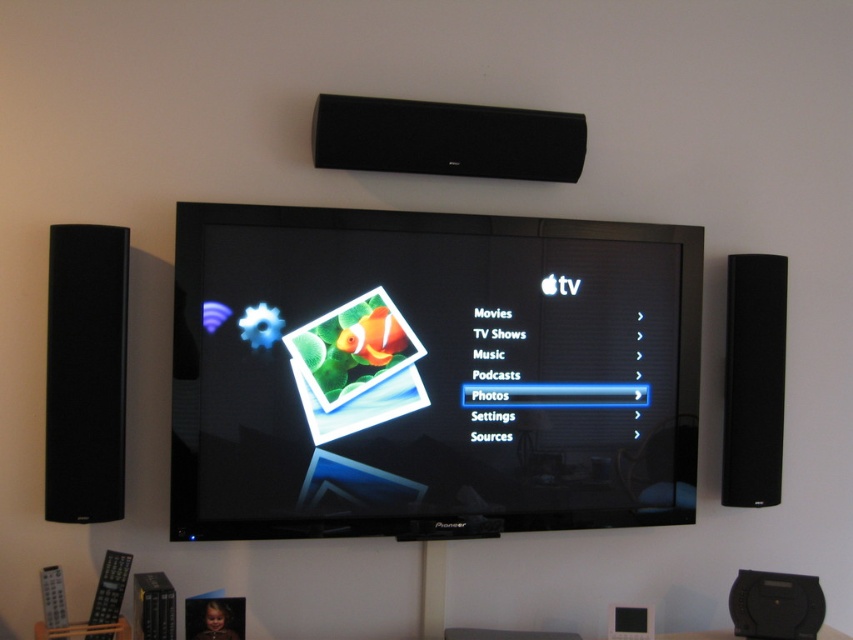
Can you confirm if black matte speaker at left is bigger than black matte speaker at upper center?

No, black matte speaker at left is not bigger than black matte speaker at upper center.

Does black matte speaker at left appear over black matte speaker at upper center?

Actually, black matte speaker at left is below black matte speaker at upper center.

Does point (74, 476) come closer to viewer compared to point (566, 115)?

That is True.

You are a GUI agent. You are given a task and a screenshot of the screen. Output one action in this format:
    pyautogui.click(x=<x>, y=<y>)
    Task: Click on the black matte speaker at left
    This screenshot has width=853, height=640.
    Given the screenshot: What is the action you would take?
    pyautogui.click(x=85, y=372)

You are a GUI agent. You are given a task and a screenshot of the screen. Output one action in this format:
    pyautogui.click(x=<x>, y=<y>)
    Task: Click on the black glossy tv at center
    The width and height of the screenshot is (853, 640).
    Given the screenshot: What is the action you would take?
    pyautogui.click(x=428, y=372)

Between black glossy tv at center and black matte speaker at upper center, which one has less height?

black matte speaker at upper center

The height and width of the screenshot is (640, 853). Find the location of `black glossy tv at center`. black glossy tv at center is located at coordinates (428, 372).

Does black glossy tv at center have a greater width compared to black matte speaker at left?

Indeed, black glossy tv at center has a greater width compared to black matte speaker at left.

Between black glossy tv at center and black matte speaker at left, which one has less height?

With less height is black matte speaker at left.

Does point (421, 276) lie behind point (73, 248)?

Yes, it is.

Where is `black glossy tv at center`? Image resolution: width=853 pixels, height=640 pixels. black glossy tv at center is located at coordinates (428, 372).